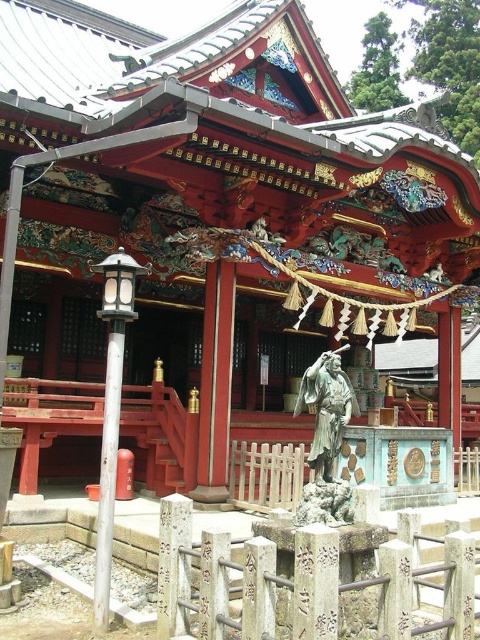
You are a visitor at the shrine and want to know which object is wider between the bronze statue at center and the white stone pillar at center. Can you tell me?

The bronze statue at center is wider than the white stone pillar at center according to the description.